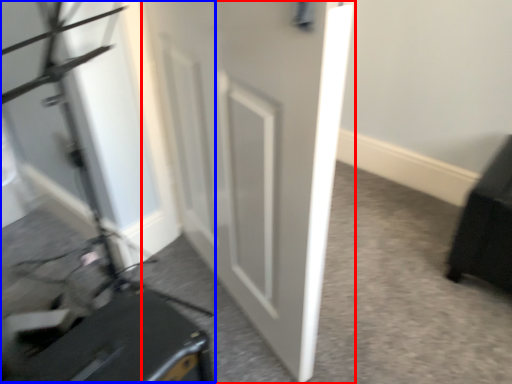
Question: Among these objects, which one is nearest to the camera, door (highlighted by a red box) or videotape (highlighted by a blue box)?

Choices:
 (A) door
 (B) videotape

Answer: (B)